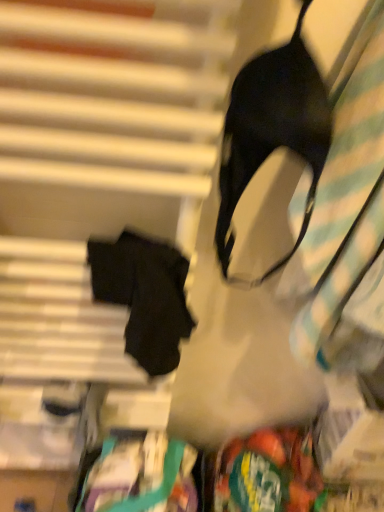
Question: Does black matte bra at upper right have a greater width compared to green plastic bag at lower right?

Choices:
 (A) yes
 (B) no

Answer: (B)

Question: From a real-world perspective, is black matte bra at upper right physically below green plastic bag at lower right?

Choices:
 (A) yes
 (B) no

Answer: (B)

Question: From the image's perspective, would you say black matte bra at upper right is positioned over green plastic bag at lower right?

Choices:
 (A) yes
 (B) no

Answer: (A)

Question: Can we say black matte bra at upper right lies outside green plastic bag at lower right?

Choices:
 (A) yes
 (B) no

Answer: (A)

Question: Is black matte bra at upper right positioned behind green plastic bag at lower right?

Choices:
 (A) no
 (B) yes

Answer: (A)

Question: From the image's perspective, relative to black matte bra at upper right, is green plastic bag at lower right above or below?

Choices:
 (A) above
 (B) below

Answer: (B)

Question: Would you say green plastic bag at lower right is inside or outside black matte bra at upper right?

Choices:
 (A) inside
 (B) outside

Answer: (B)

Question: Based on their positions, is green plastic bag at lower right located to the left or right of black matte bra at upper right?

Choices:
 (A) right
 (B) left

Answer: (A)

Question: Is point (276, 458) closer or farther from the camera than point (220, 248)?

Choices:
 (A) closer
 (B) farther

Answer: (B)

Question: In the image, is black matte bra at upper right positioned in front of or behind black matte fabric robe at left?

Choices:
 (A) behind
 (B) front

Answer: (B)

Question: From the image's perspective, is black matte bra at upper right located above or below black matte fabric robe at left?

Choices:
 (A) above
 (B) below

Answer: (A)

Question: Is point (258, 103) positioned closer to the camera than point (160, 305)?

Choices:
 (A) closer
 (B) farther

Answer: (A)

Question: In terms of width, does black matte bra at upper right look wider or thinner when compared to black matte fabric robe at left?

Choices:
 (A) wide
 (B) thin

Answer: (A)

Question: Does point (185, 322) appear closer or farther from the camera than point (231, 505)?

Choices:
 (A) farther
 (B) closer

Answer: (B)

Question: From a real-world perspective, relative to green plastic bag at lower right, is black matte fabric robe at left vertically above or below?

Choices:
 (A) below
 (B) above

Answer: (B)